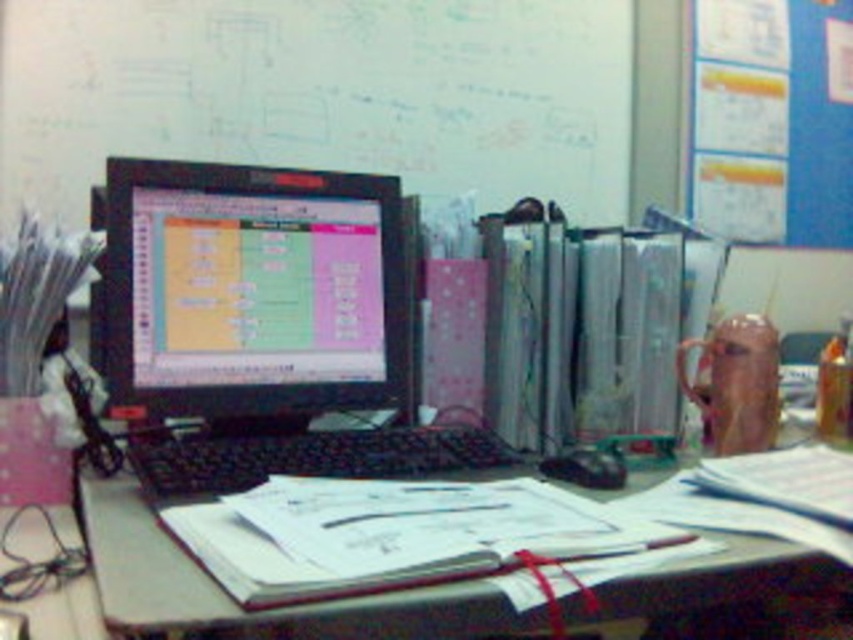
Question: Is matte black monitor at center wider than blue paperboard at upper right?

Choices:
 (A) yes
 (B) no

Answer: (B)

Question: Which object is closer to the camera taking this photo?

Choices:
 (A) black plastic keyboard at center
 (B) blue paperboard at upper right
 (C) matte black monitor at center
 (D) white paper at center

Answer: (D)

Question: Which of the following is the farthest from the observer?

Choices:
 (A) blue paperboard at upper right
 (B) matte black monitor at center
 (C) white paper at center
 (D) black plastic keyboard at center

Answer: (A)

Question: Does whiteboard at upper center lie in front of matte black monitor at center?

Choices:
 (A) no
 (B) yes

Answer: (A)

Question: Can you confirm if matte black monitor at center is wider than blue paperboard at upper right?

Choices:
 (A) yes
 (B) no

Answer: (B)

Question: Which of the following is the closest to the observer?

Choices:
 (A) whiteboard at upper center
 (B) matte black monitor at center

Answer: (B)